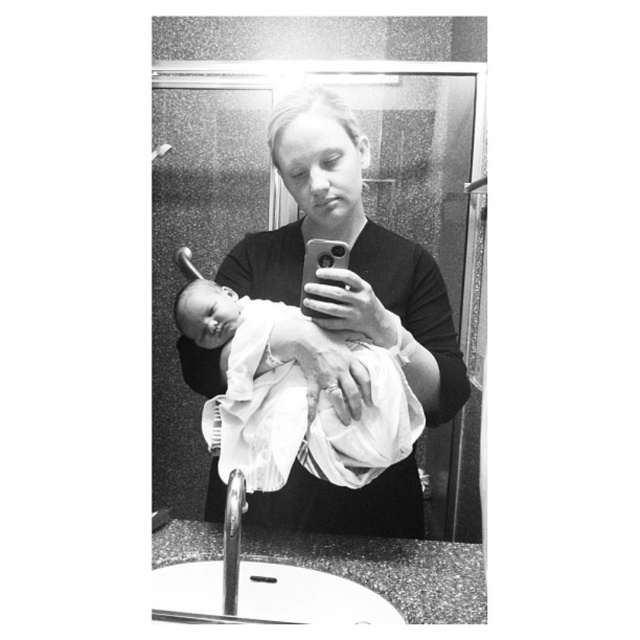
Is soft white swaddle at center wider than white clothed baby at center?

Indeed, soft white swaddle at center has a greater width compared to white clothed baby at center.

The width and height of the screenshot is (640, 640). Find the location of `soft white swaddle at center`. soft white swaddle at center is located at coordinates (349, 253).